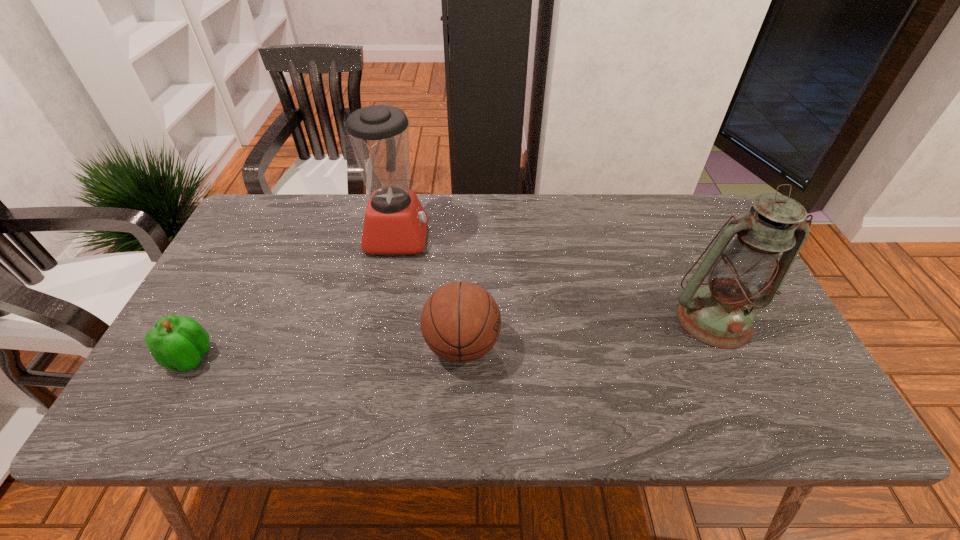
Locate an element on the screen. the farthest object is located at coordinates (395, 222).

At what (x,y) coordinates should I click in order to perform the action: click on the second object from left to right. Please return your answer as a coordinate pair (x, y). Looking at the image, I should click on (395, 222).

The height and width of the screenshot is (540, 960). In order to click on the rightmost object in this screenshot , I will do `click(741, 277)`.

The height and width of the screenshot is (540, 960). Find the location of `the second shortest object`. the second shortest object is located at coordinates (460, 322).

Identify the location of basketball. (460, 322).

The image size is (960, 540). In order to click on the leftmost object in this screenshot , I will do `click(176, 342)`.

Locate an element on the screen. The image size is (960, 540). the shortest object is located at coordinates (176, 342).

This screenshot has height=540, width=960. I want to click on vacant space situated 0.330m on the front of the farthest object near the controls, so click(x=539, y=237).

Locate an element on the screen. The height and width of the screenshot is (540, 960). free location located 0.050m on the back of the oil lamp is located at coordinates (695, 279).

You are a GUI agent. You are given a task and a screenshot of the screen. Output one action in this format:
    pyautogui.click(x=<x>, y=<y>)
    Task: Click on the free region located on the side with brand label of the third tallest object
    This screenshot has height=540, width=960.
    Given the screenshot: What is the action you would take?
    (x=579, y=346)